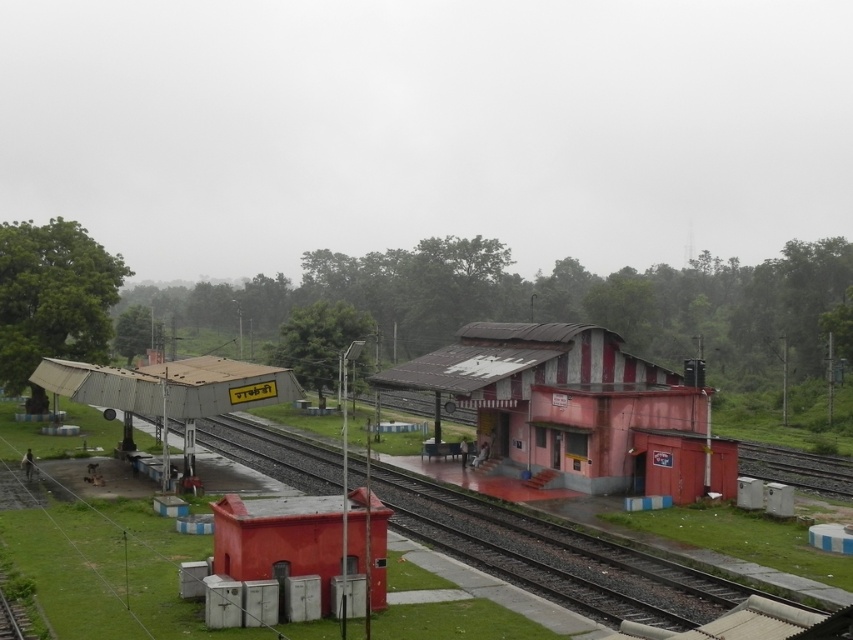
Question: Can you confirm if rusty metal railway station at center is wider than smooth red utility box at lower left?

Choices:
 (A) no
 (B) yes

Answer: (B)

Question: Which object is farther from the camera taking this photo?

Choices:
 (A) smooth concrete train track at center
 (B) smooth red utility box at lower left
 (C) rusty metal railway station at center

Answer: (C)

Question: Among these points, which one is nearest to the camera?

Choices:
 (A) (387, 516)
 (B) (641, 385)
 (C) (508, 573)

Answer: (A)

Question: Does rusty metal railway station at center lie in front of smooth red utility box at lower left?

Choices:
 (A) yes
 (B) no

Answer: (B)

Question: Which point is farther to the camera?

Choices:
 (A) rusty metal railway station at center
 (B) smooth red utility box at lower left
 (C) smooth concrete train track at center

Answer: (A)

Question: Can you confirm if smooth concrete train track at center is positioned below smooth red utility box at lower left?

Choices:
 (A) no
 (B) yes

Answer: (B)